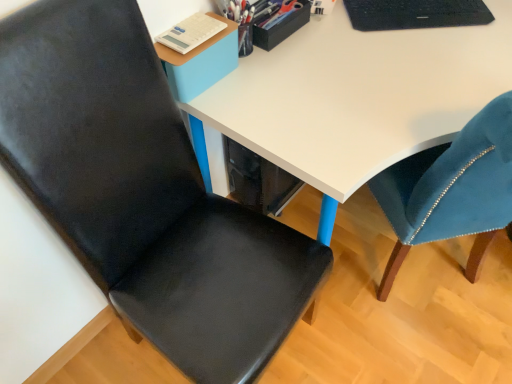
Question: Is black textured laptop at upper right facing towards matte black chair at left?

Choices:
 (A) no
 (B) yes

Answer: (A)

Question: Is black textured laptop at upper right to the left of matte black chair at left from the viewer's perspective?

Choices:
 (A) no
 (B) yes

Answer: (A)

Question: Can you confirm if black textured laptop at upper right is wider than matte black chair at left?

Choices:
 (A) no
 (B) yes

Answer: (A)

Question: Is black textured laptop at upper right beside matte black chair at left?

Choices:
 (A) yes
 (B) no

Answer: (B)

Question: Can you confirm if black textured laptop at upper right is bigger than matte black chair at left?

Choices:
 (A) no
 (B) yes

Answer: (A)

Question: Based on their sizes in the image, would you say black textured laptop at upper right is bigger or smaller than metallic pen holder at upper center?

Choices:
 (A) big
 (B) small

Answer: (A)

Question: Is black textured laptop at upper right in front of or behind metallic pen holder at upper center in the image?

Choices:
 (A) behind
 (B) front

Answer: (A)

Question: From the image's perspective, is black textured laptop at upper right above or below metallic pen holder at upper center?

Choices:
 (A) above
 (B) below

Answer: (A)

Question: Would you say black textured laptop at upper right is to the left or to the right of metallic pen holder at upper center in the picture?

Choices:
 (A) right
 (B) left

Answer: (A)

Question: From a real-world perspective, relative to metallic pen holder at upper center, is matte black chair at left vertically above or below?

Choices:
 (A) above
 (B) below

Answer: (B)

Question: From the image's perspective, is matte black chair at left located above or below metallic pen holder at upper center?

Choices:
 (A) below
 (B) above

Answer: (A)

Question: Is matte black chair at left to the left or to the right of metallic pen holder at upper center in the image?

Choices:
 (A) right
 (B) left

Answer: (B)

Question: In terms of width, does matte black chair at left look wider or thinner when compared to metallic pen holder at upper center?

Choices:
 (A) wide
 (B) thin

Answer: (A)

Question: From the image's perspective, relative to metallic pen holder at upper center, is white glossy desk at center above or below?

Choices:
 (A) below
 (B) above

Answer: (A)

Question: Based on their sizes in the image, would you say white glossy desk at center is bigger or smaller than metallic pen holder at upper center?

Choices:
 (A) big
 (B) small

Answer: (A)